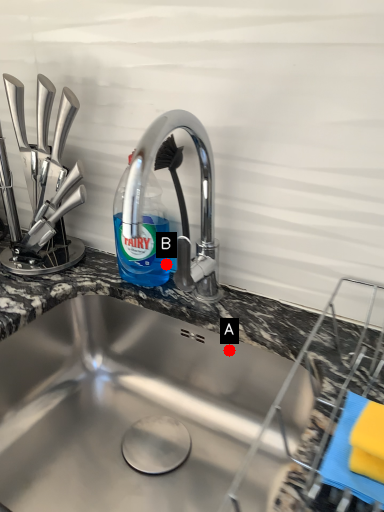
Question: Two points are circled on the image, labeled by A and B beside each circle. Which of the following is the closest to the observer?

Choices:
 (A) A is closer
 (B) B is closer

Answer: (A)